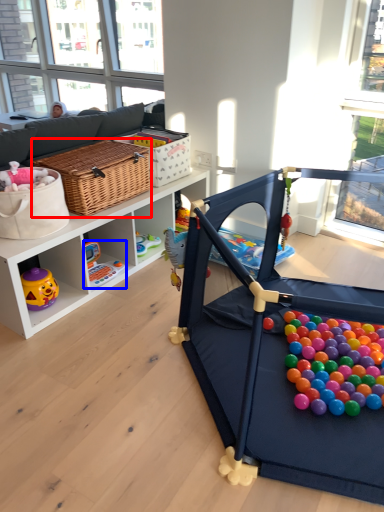
Question: Among these objects, which one is farthest to the camera, picnic basket (highlighted by a red box) or toy (highlighted by a blue box)?

Choices:
 (A) picnic basket
 (B) toy

Answer: (B)